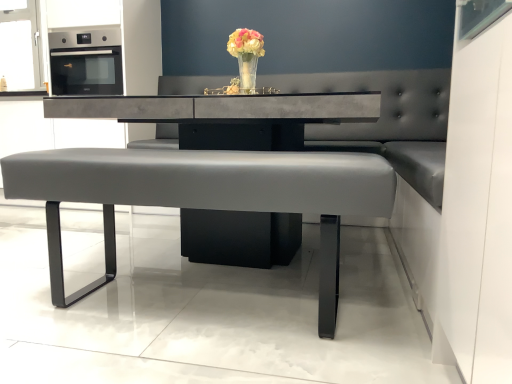
What do you see at coordinates (204, 195) in the screenshot? The width and height of the screenshot is (512, 384). I see `matte gray bench at center` at bounding box center [204, 195].

What do you see at coordinates (86, 62) in the screenshot?
I see `satin black oven at upper left` at bounding box center [86, 62].

From the picture: In order to face concrete table at center, should I rotate leftwards or rightwards?

A 0.111 degree turn to the left will do.

I want to click on matte gray bench at center, so click(x=204, y=195).

In the scene shown: Is satin black oven at upper left in front of or behind concrete table at center in the image?

satin black oven at upper left is positioned farther from the viewer than concrete table at center.

Is satin black oven at upper left spatially inside concrete table at center, or outside of it?

satin black oven at upper left is outside concrete table at center.

Does satin black oven at upper left have a lesser height compared to concrete table at center?

Yes, satin black oven at upper left is shorter than concrete table at center.

Looking at this image, is satin black oven at upper left wider or thinner than concrete table at center?

satin black oven at upper left is thinner than concrete table at center.

From a real-world perspective, does concrete table at center sit lower than translucent glass vase at center?

Correct, in the physical world, concrete table at center is lower than translucent glass vase at center.

Could you tell me if concrete table at center is turned towards translucent glass vase at center?

No, concrete table at center is not aimed at translucent glass vase at center.

Locate an element on the screen. round table in front of the translucent glass vase at center is located at coordinates (228, 116).

What are the coordinates of `round table on the right side of translucent glass vase at center` in the screenshot? It's located at (228, 116).

Is translucent glass vase at center to the right of concrete table at center from the viewer's perspective?

In fact, translucent glass vase at center is to the left of concrete table at center.

Between translucent glass vase at center and concrete table at center, which one has smaller width?

translucent glass vase at center.

From the image's perspective, is satin black oven at upper left positioned above or below matte gray bench at center?

From the image's perspective, satin black oven at upper left appears above matte gray bench at center.

Is matte gray bench at center at the back of satin black oven at upper left?

That's not correct — satin black oven at upper left is not looking away from matte gray bench at center.

Does satin black oven at upper left have a lesser height compared to matte gray bench at center?

Yes.

Which object is thinner, satin black oven at upper left or matte gray bench at center?

matte gray bench at center.

Locate an element on the screen. appliance behind the translucent glass vase at center is located at coordinates (86, 62).

Is translucent glass vase at center behind satin black oven at upper left?

No, the depth of translucent glass vase at center is less than that of satin black oven at upper left.

Does point (250, 39) lie in front of point (57, 85)?

That is True.

Does translucent glass vase at center have a lesser width compared to satin black oven at upper left?

Correct, the width of translucent glass vase at center is less than that of satin black oven at upper left.

Can you confirm if translucent glass vase at center is thinner than matte gray bench at center?

Correct, the width of translucent glass vase at center is less than that of matte gray bench at center.

Is translucent glass vase at center far away from matte gray bench at center?

translucent glass vase at center is actually quite close to matte gray bench at center.

Could you tell me if translucent glass vase at center is facing matte gray bench at center?

No, translucent glass vase at center is not turned towards matte gray bench at center.

Find the location of a particular element. The image size is (512, 384). round table on the right of matte gray bench at center is located at coordinates (228, 116).

Between matte gray bench at center and concrete table at center, which one appears on the left side from the viewer's perspective?

matte gray bench at center is more to the left.

Which is correct: matte gray bench at center is inside concrete table at center, or outside of it?

matte gray bench at center is located inside concrete table at center.

Measure the distance from matte gray bench at center to concrete table at center.

matte gray bench at center and concrete table at center are 14.25 inches apart from each other.

The image size is (512, 384). What are the coordinates of `round table to the right of satin black oven at upper left` in the screenshot? It's located at (228, 116).

This screenshot has width=512, height=384. I want to click on floral arrangement that is behind the concrete table at center, so click(246, 56).

In the scene shown: When comparing their distances from translucent glass vase at center, does concrete table at center or matte gray bench at center seem closer?

concrete table at center.

Estimate the real-world distances between objects in this image. Which object is further from translucent glass vase at center, satin black oven at upper left or matte gray bench at center?

Based on the image, satin black oven at upper left appears to be further to translucent glass vase at center.

When comparing their distances from satin black oven at upper left, does matte gray bench at center or translucent glass vase at center seem closer?

translucent glass vase at center is closer to satin black oven at upper left.

When comparing their distances from translucent glass vase at center, does concrete table at center or satin black oven at upper left seem closer?

concrete table at center is closer to translucent glass vase at center.

Based on the photo, estimate the real-world distances between objects in this image. Which object is closer to satin black oven at upper left, translucent glass vase at center or matte gray bench at center?

The object closer to satin black oven at upper left is translucent glass vase at center.

From the image, which object appears to be farther from matte gray bench at center, concrete table at center or satin black oven at upper left?

satin black oven at upper left is further to matte gray bench at center.

From the image, which object appears to be nearer to matte gray bench at center, concrete table at center or translucent glass vase at center?

concrete table at center is closer to matte gray bench at center.

Which object lies nearer to the anchor point matte gray bench at center, satin black oven at upper left or translucent glass vase at center?

The object closer to matte gray bench at center is translucent glass vase at center.

You are a GUI agent. You are given a task and a screenshot of the screen. Output one action in this format:
    pyautogui.click(x=<x>, y=<y>)
    Task: Click on the floral arrangement positioned between matte gray bench at center and satin black oven at upper left from near to far
    Image resolution: width=512 pixels, height=384 pixels.
    Given the screenshot: What is the action you would take?
    pyautogui.click(x=246, y=56)

The height and width of the screenshot is (384, 512). In order to click on round table located between matte gray bench at center and translucent glass vase at center in the depth direction in this screenshot , I will do point(228,116).

You are a GUI agent. You are given a task and a screenshot of the screen. Output one action in this format:
    pyautogui.click(x=<x>, y=<y>)
    Task: Click on the round table between matte gray bench at center and satin black oven at upper left from front to back
    
    Given the screenshot: What is the action you would take?
    pyautogui.click(x=228, y=116)

The height and width of the screenshot is (384, 512). What are the coordinates of `floral arrangement between concrete table at center and satin black oven at upper left in the front-back direction` in the screenshot? It's located at (246, 56).